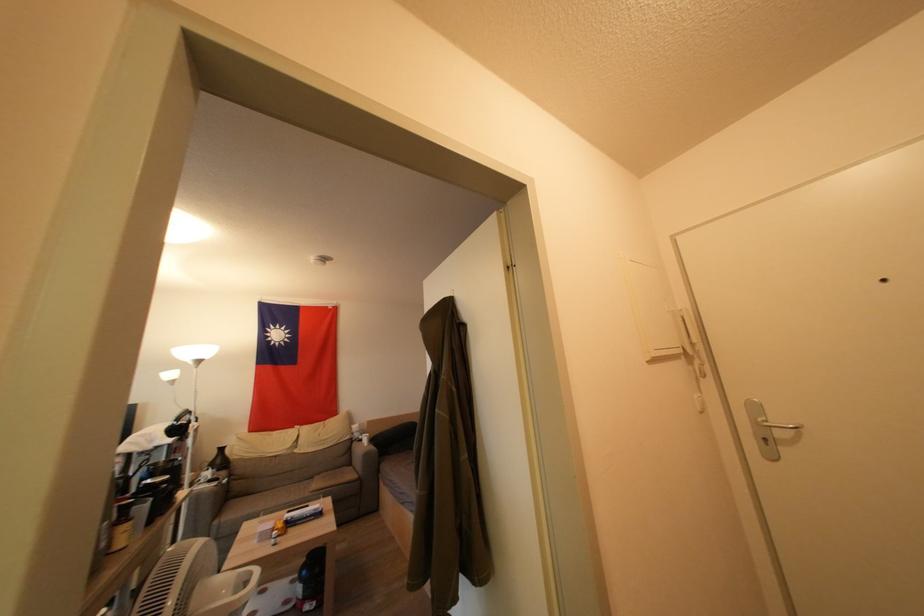
What do you see at coordinates (195, 583) in the screenshot? The image size is (924, 616). I see `the white intercom handset` at bounding box center [195, 583].